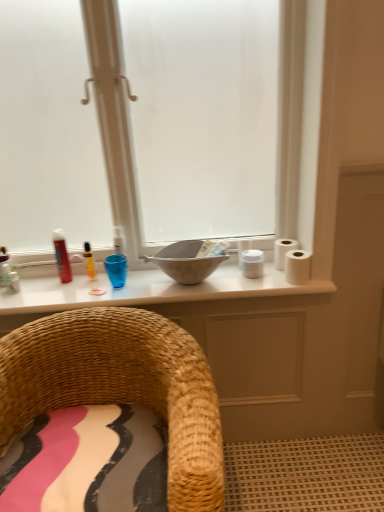
Where is `blank space above matte white countertop at center (from a real-world perspective)`? This screenshot has width=384, height=512. blank space above matte white countertop at center (from a real-world perspective) is located at coordinates (117, 287).